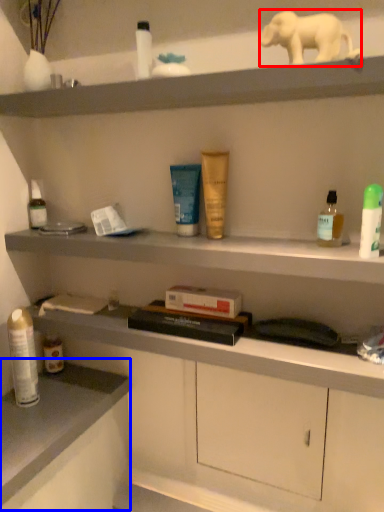
Question: Which point is closer to the camera, elephant (highlighted by a red box) or counter top (highlighted by a blue box)?

Choices:
 (A) elephant
 (B) counter top

Answer: (A)